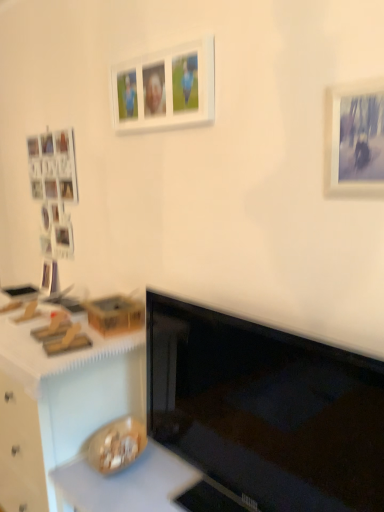
Question: Is point (117, 345) positioned closer to the camera than point (327, 90)?

Choices:
 (A) closer
 (B) farther

Answer: (B)

Question: In terms of width, does wooden desk at lower left look wider or thinner when compared to matte white picture frame at upper right, positioned as the second picture frame in top-to-bottom order?

Choices:
 (A) wide
 (B) thin

Answer: (A)

Question: Which of these objects is positioned closest to the white matte picture frame at upper center, the 2th picture frame viewed from the front?

Choices:
 (A) white matte counter top at lower left, arranged as the first counter top when viewed from the top
 (B) smooth white countertop at lower center, placed as the 1th counter top when sorted from bottom to top
 (C) black glossy monitor at center
 (D) wooden desk at lower left
 (E) matte white picture frame at upper right, placed as the second picture frame when sorted from back to front

Answer: (E)

Question: Considering the real-world distances, which object is closest to the white matte picture frame at upper center, which is the 2th picture frame from bottom to top?

Choices:
 (A) black glossy monitor at center
 (B) wooden desk at lower left
 (C) matte white picture frame at upper right, which ranks as the second picture frame in left-to-right order
 (D) smooth white countertop at lower center, placed as the 1th counter top when sorted from bottom to top
 (E) white matte counter top at lower left, arranged as the second counter top when ordered from the bottom

Answer: (C)